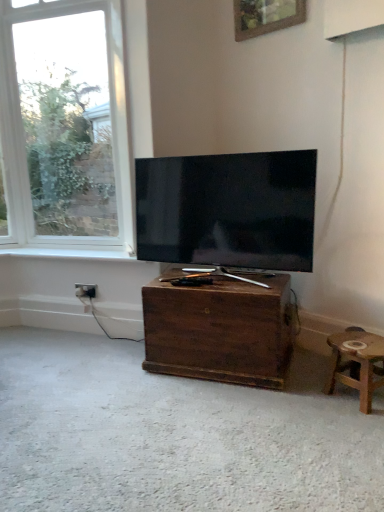
Question: Would you say wooden picture frame at upper center is a long distance from white wood window sill at lower left?

Choices:
 (A) yes
 (B) no

Answer: (A)

Question: Could you tell me if wooden picture frame at upper center is facing white wood window sill at lower left?

Choices:
 (A) no
 (B) yes

Answer: (A)

Question: Considering the relative sizes of wooden picture frame at upper center and white wood window sill at lower left in the image provided, is wooden picture frame at upper center wider than white wood window sill at lower left?

Choices:
 (A) no
 (B) yes

Answer: (A)

Question: Is wooden picture frame at upper center completely or partially outside of white wood window sill at lower left?

Choices:
 (A) no
 (B) yes

Answer: (B)

Question: Considering the relative sizes of wooden picture frame at upper center and white wood window sill at lower left in the image provided, is wooden picture frame at upper center smaller than white wood window sill at lower left?

Choices:
 (A) no
 (B) yes

Answer: (B)

Question: From a real-world perspective, is wooden picture frame at upper center on white wood window sill at lower left?

Choices:
 (A) yes
 (B) no

Answer: (A)

Question: From the image's perspective, is dark wood chest at center above clear glass window at upper left?

Choices:
 (A) no
 (B) yes

Answer: (A)

Question: Considering the relative positions of dark wood chest at center and clear glass window at upper left in the image provided, is dark wood chest at center behind clear glass window at upper left?

Choices:
 (A) no
 (B) yes

Answer: (A)

Question: Are dark wood chest at center and clear glass window at upper left far apart?

Choices:
 (A) yes
 (B) no

Answer: (A)

Question: From a real-world perspective, is dark wood chest at center on clear glass window at upper left?

Choices:
 (A) yes
 (B) no

Answer: (B)

Question: Could you tell me if dark wood chest at center is facing clear glass window at upper left?

Choices:
 (A) yes
 (B) no

Answer: (B)

Question: Is dark wood chest at center located outside clear glass window at upper left?

Choices:
 (A) yes
 (B) no

Answer: (A)

Question: Does dark wood chest at center have a smaller size compared to white wood window sill at lower left?

Choices:
 (A) yes
 (B) no

Answer: (B)